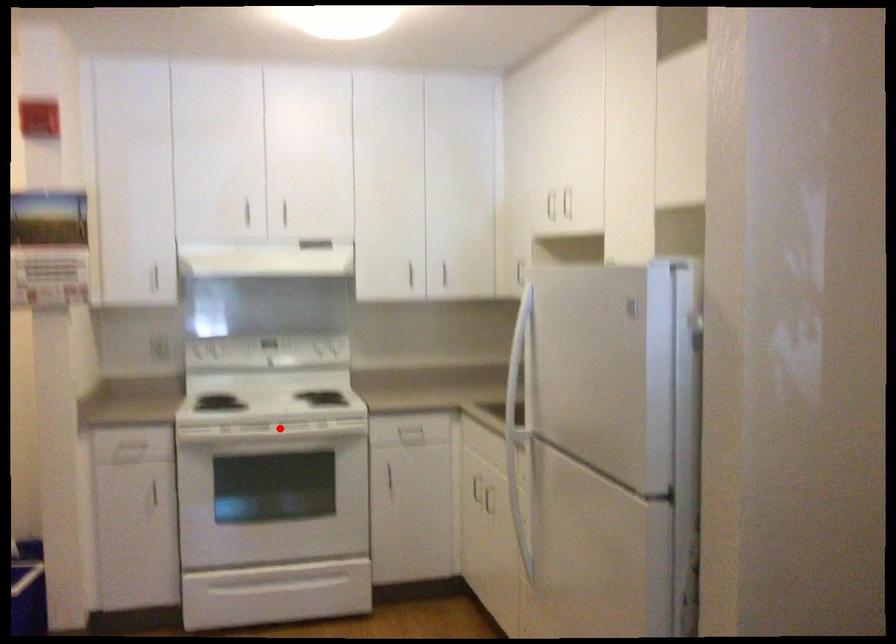
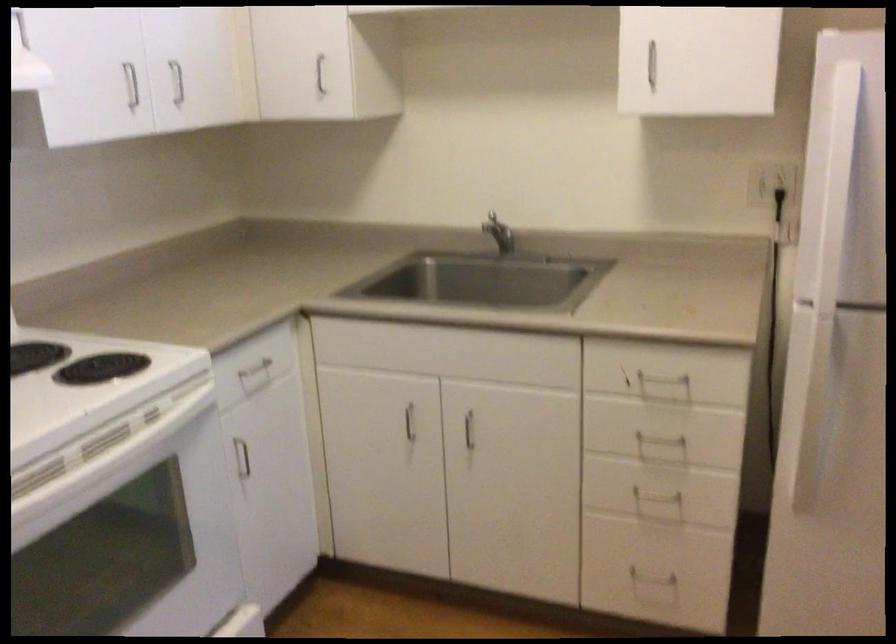
Question: I am providing you with two images of the same scene from different viewpoints. In image1, a red point is highlighted. Considering the same 3D point in image2, which of the following is correct?

Choices:
 (A) It is closer
 (B) It is farther

Answer: (A)